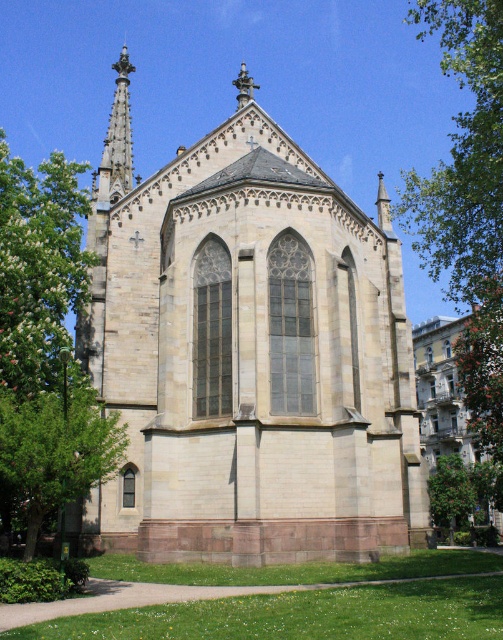
You are standing in front of the beige stone church at center and want to take a photo of the green leafy tree at upper right. Which direction should you turn to face the tree?

The beige stone church at center is to the left of the green leafy tree at upper right, so you should turn to your right to face the tree.

You are standing in a park and see the beige stone church at center. Where would you look to find it?

The beige stone church at center is located at the center of the image, so you should look straight ahead to find it.